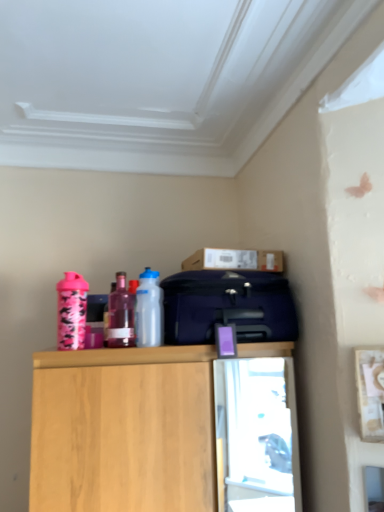
Question: Based on their positions, is translucent purple bottle at center, placed as the 2th bottle when sorted from left to right, located to the left or right of cardboard box at upper center?

Choices:
 (A) right
 (B) left

Answer: (B)

Question: In the image, is translucent purple bottle at center, marked as the second bottle in a right-to-left arrangement, positioned in front of or behind cardboard box at upper center?

Choices:
 (A) behind
 (B) front

Answer: (B)

Question: Considering the real-world distances, which object is farthest from the pink matte shaker at left, arranged as the 3th bottle when viewed from the right?

Choices:
 (A) wooden cabinet at upper center
 (B) cardboard box at upper center
 (C) matte blue suitcase at center
 (D) transparent plastic bottle at center, which is counted as the first bottle, starting from the right
 (E) translucent purple bottle at center, placed as the 2th bottle when sorted from left to right

Answer: (B)

Question: Considering the real-world distances, which object is farthest from the pink matte shaker at left, positioned as the first bottle in left-to-right order?

Choices:
 (A) wooden cabinet at upper center
 (B) translucent purple bottle at center, placed as the 2th bottle when sorted from left to right
 (C) cardboard box at upper center
 (D) matte blue suitcase at center
 (E) transparent plastic bottle at center, which is counted as the first bottle, starting from the right

Answer: (C)